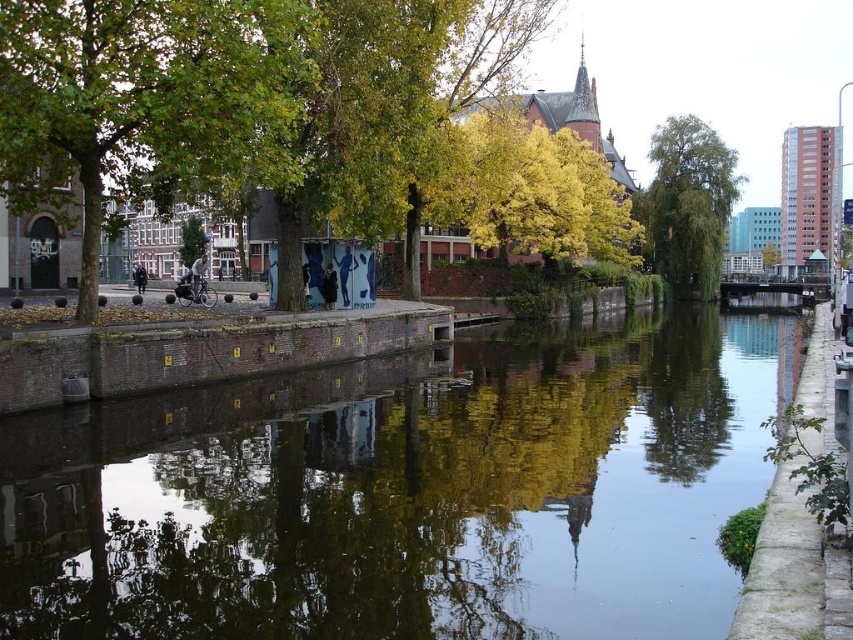
Does smooth concrete canal at center have a lesser width compared to green leafy tree at left?

In fact, smooth concrete canal at center might be wider than green leafy tree at left.

Does smooth concrete canal at center have a greater width compared to green leafy tree at left?

Correct, the width of smooth concrete canal at center exceeds that of green leafy tree at left.

Find the location of a particular element. The width and height of the screenshot is (853, 640). smooth concrete canal at center is located at coordinates (407, 492).

Which is above, green leafy tree at left or green leafy tree at center?

green leafy tree at center is above.

Does green leafy tree at left have a smaller size compared to green leafy tree at center?

Indeed, green leafy tree at left has a smaller size compared to green leafy tree at center.

Which is in front, point (273, 164) or point (695, 129)?

Point (273, 164) is more forward.

The image size is (853, 640). I want to click on green leafy tree at left, so click(144, 97).

Can you confirm if smooth concrete canal at center is thinner than green matte tree at center?

No.

Which is more to the right, smooth concrete canal at center or green matte tree at center?

smooth concrete canal at center

The width and height of the screenshot is (853, 640). Find the location of `smooth concrete canal at center`. smooth concrete canal at center is located at coordinates (407, 492).

Image resolution: width=853 pixels, height=640 pixels. Identify the location of smooth concrete canal at center. (407, 492).